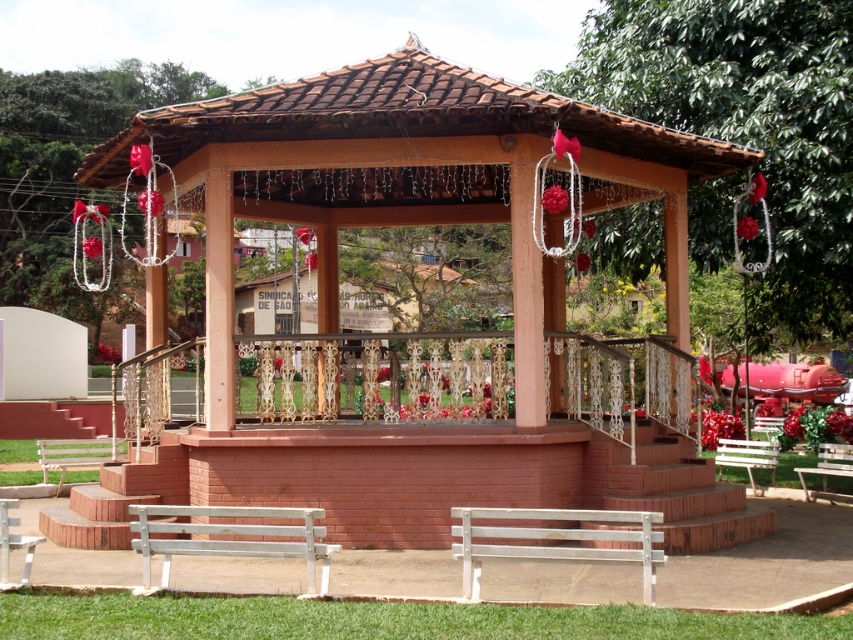
Question: Is white painted wood bench at lower center below white wooden bench at lower right?

Choices:
 (A) no
 (B) yes

Answer: (A)

Question: Among these points, which one is nearest to the camera?

Choices:
 (A) (54, 460)
 (B) (628, 531)

Answer: (B)

Question: Observing the image, what is the correct spatial positioning of white painted wood bench at lower center in reference to white wooden bench at lower left?

Choices:
 (A) left
 (B) right

Answer: (B)

Question: Does white wooden bench at lower center appear under white wooden bench at lower right?

Choices:
 (A) yes
 (B) no

Answer: (B)

Question: Which object appears closest to the camera in this image?

Choices:
 (A) brown brick gazebo at center
 (B) white wood bench at lower left

Answer: (B)

Question: Which of these objects is positioned farthest from the brown brick gazebo at center?

Choices:
 (A) white wooden bench at lower center
 (B) white wooden bench at lower left
 (C) white wooden bench at center

Answer: (B)